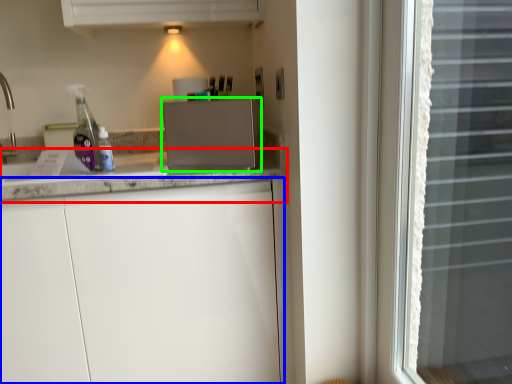
Question: Which object is the farthest from countertop (highlighted by a red box)? Choose among these: cabinetry (highlighted by a blue box) or appliance (highlighted by a green box).

Choices:
 (A) cabinetry
 (B) appliance

Answer: (A)